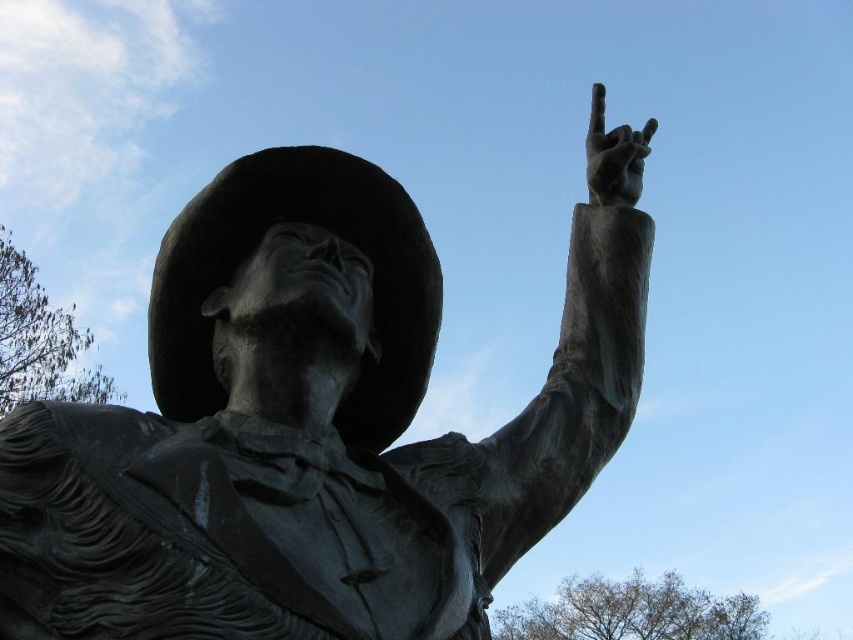
Question: Is bronze statue at upper center further to camera compared to bronze hand at upper right?

Choices:
 (A) no
 (B) yes

Answer: (A)

Question: From the image, what is the correct spatial relationship of bronze statue at upper center in relation to bronze hand at upper right?

Choices:
 (A) left
 (B) right

Answer: (A)

Question: Which of the following is the closest to the observer?

Choices:
 (A) bronze hand at upper right
 (B) bronze statue at upper center

Answer: (B)

Question: Does bronze statue at upper center appear over bronze hand at upper right?

Choices:
 (A) no
 (B) yes

Answer: (A)

Question: Which object is farther from the camera taking this photo?

Choices:
 (A) bronze statue at upper center
 (B) bronze hand at upper right

Answer: (B)